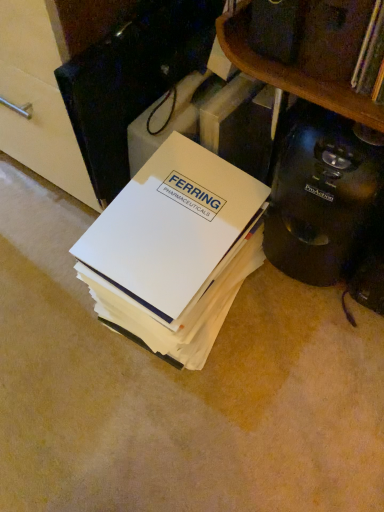
Locate an element on the screen. empty space that is ontop of white paper at center (from a real-world perspective) is located at coordinates (182, 178).